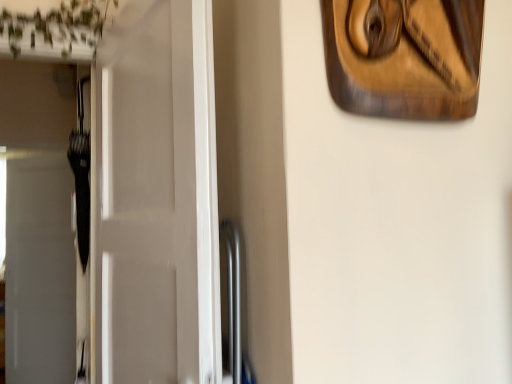
Question: From a real-world perspective, is wooden carving at upper right above or below white glossy door at left?

Choices:
 (A) above
 (B) below

Answer: (A)

Question: Considering the positions of point pos(359,107) and point pos(117,44), is point pos(359,107) closer or farther from the camera than point pos(117,44)?

Choices:
 (A) closer
 (B) farther

Answer: (A)

Question: In the image, is wooden carving at upper right positioned in front of or behind white glossy door at left?

Choices:
 (A) front
 (B) behind

Answer: (A)

Question: Is white glossy door at left bigger or smaller than wooden carving at upper right?

Choices:
 (A) small
 (B) big

Answer: (B)

Question: Is white glossy door at left to the left or to the right of wooden carving at upper right in the image?

Choices:
 (A) right
 (B) left

Answer: (B)

Question: From the image's perspective, is white glossy door at left located above or below wooden carving at upper right?

Choices:
 (A) below
 (B) above

Answer: (A)

Question: From a real-world perspective, relative to wooden carving at upper right, is white glossy door at left vertically above or below?

Choices:
 (A) below
 (B) above

Answer: (A)